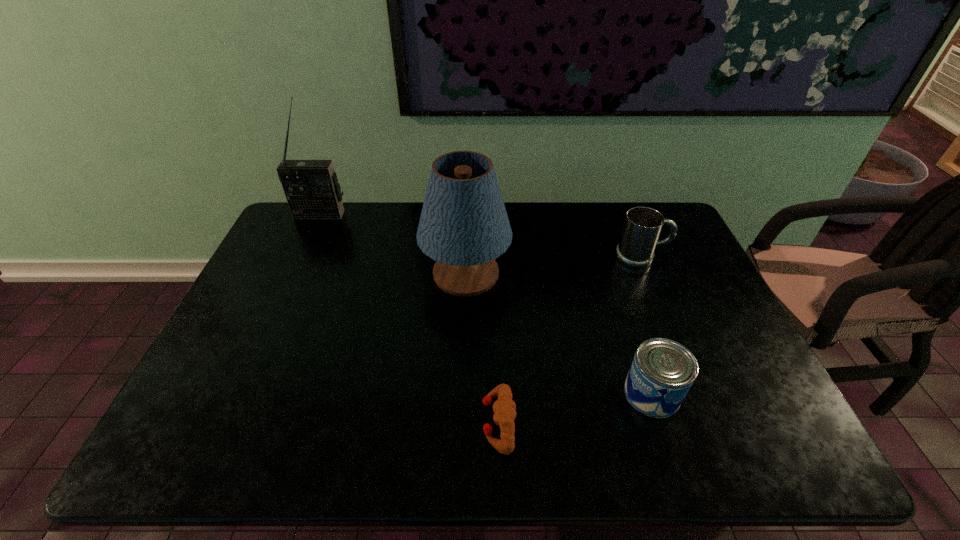
Locate an element on the screen. vacant region located on the front label of the can is located at coordinates (477, 393).

This screenshot has width=960, height=540. I want to click on vacant space situated 0.350m on the front label of the can, so tap(477, 393).

Where is `vacant space located with the gloves of the shortest object facing forward`? The height and width of the screenshot is (540, 960). vacant space located with the gloves of the shortest object facing forward is located at coordinates (412, 422).

Find the location of a particular element. free space located 0.100m with the gloves of the shortest object facing forward is located at coordinates (438, 422).

You are a GUI agent. You are given a task and a screenshot of the screen. Output one action in this format:
    pyautogui.click(x=<x>, y=<y>)
    Task: Click on the vacant area situated 0.200m with the gloves of the shortest object facing forward
    
    Given the screenshot: What is the action you would take?
    pyautogui.click(x=394, y=422)

Where is `object that is at the far edge`? The height and width of the screenshot is (540, 960). object that is at the far edge is located at coordinates (311, 187).

Find the location of a particular element. The width and height of the screenshot is (960, 540). object located in the near edge section of the desktop is located at coordinates (504, 407).

Identify the location of object that is at the left edge. This screenshot has width=960, height=540. (311, 187).

Locate an element on the screen. The height and width of the screenshot is (540, 960). object located at the right edge is located at coordinates tap(643, 225).

Image resolution: width=960 pixels, height=540 pixels. In order to click on object located at the far left corner in this screenshot , I will do `click(311, 187)`.